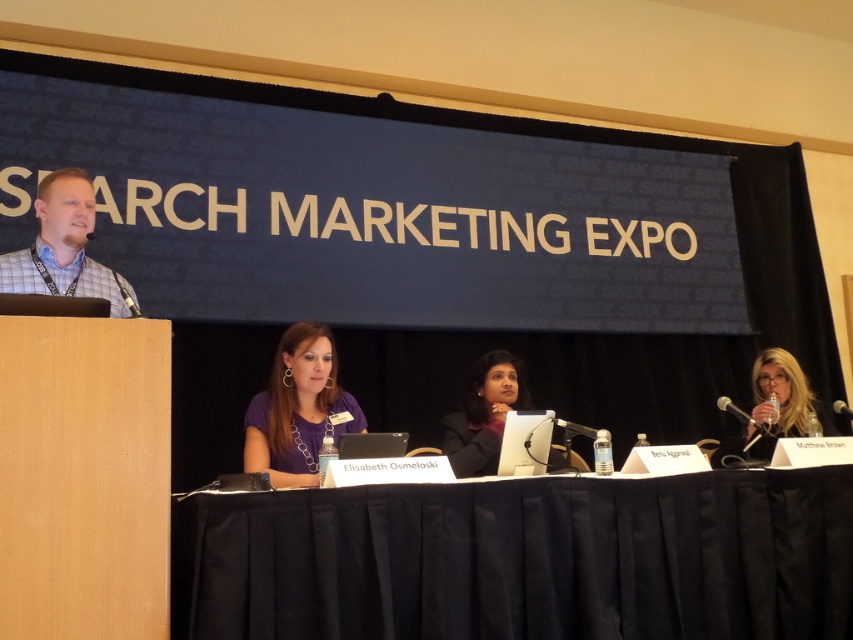
You are attending the panel discussion at the SEARCH MARKETING EXPO and notice two panelists wearing different shirts. The purple fabric shirt at center and the plaid shirt at left. From your perspective facing the stage, which shirt is positioned to the right of the other?

The purple fabric shirt at center is positioned to the right of the plaid shirt at left.

You are attending the panel discussion at the SEARCH MARKETING EXPO and notice the black fabric table at lower center and the matte blonde hair at right. Based on their positions, which object is closer to the front of the stage?

The black fabric table at lower center is located below matte blonde hair at right, meaning it is closer to the front of the stage compared to the matte blonde hair at right.